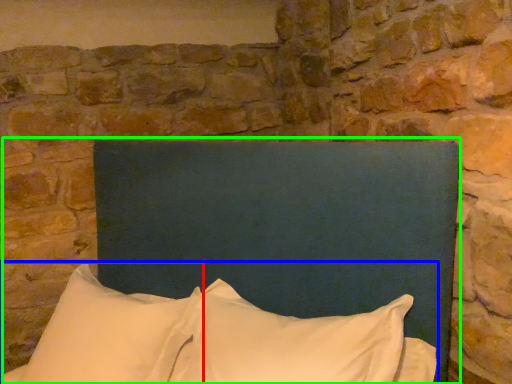
Question: Which object is positioned closest to pillow (highlighted by a red box)? Select from pillow (highlighted by a blue box) and bed (highlighted by a green box).

Choices:
 (A) pillow
 (B) bed

Answer: (A)